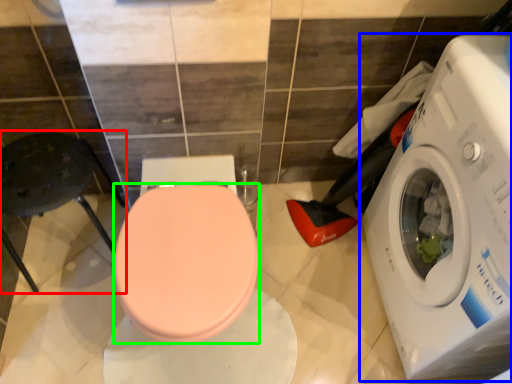
Question: Based on their relative distances, which object is nearer to chair (highlighted by a red box)? Choose from washing machine (highlighted by a blue box) and bidet (highlighted by a green box).

Choices:
 (A) washing machine
 (B) bidet

Answer: (B)